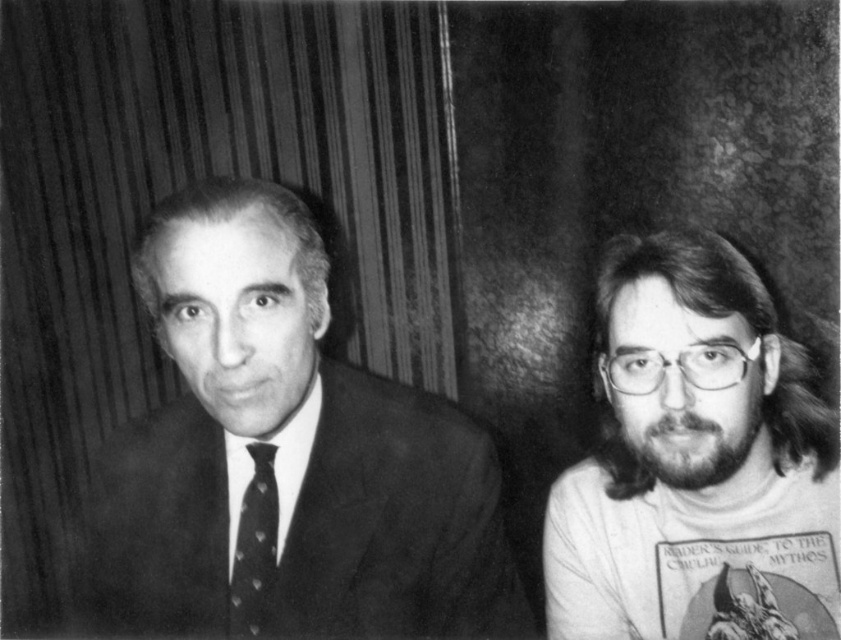
Question: Considering the real-world distances, which object is closest to the bearded man with glasses at right?

Choices:
 (A) smooth black suit at left
 (B) polka dot silk tie at left

Answer: (A)

Question: Is bearded man with glasses at right in front of polka dot silk tie at left?

Choices:
 (A) no
 (B) yes

Answer: (B)

Question: Which point is farther to the camera?

Choices:
 (A) bearded man with glasses at right
 (B) smooth black suit at left

Answer: (A)

Question: Observing the image, what is the correct spatial positioning of smooth black suit at left in reference to polka dot silk tie at left?

Choices:
 (A) above
 (B) below

Answer: (A)

Question: Among these points, which one is farthest from the camera?

Choices:
 (A) (795, 486)
 (B) (260, 502)
 (C) (279, 483)

Answer: (C)

Question: Is smooth black suit at left positioned behind bearded man with glasses at right?

Choices:
 (A) no
 (B) yes

Answer: (A)